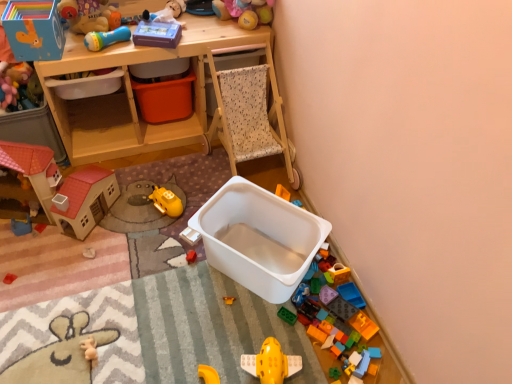
Question: Is blue plastic toy at left, which appears as the fifth toy when viewed from the top, aimed at soft plush toy at upper center, the fifth toy positioned from the right?

Choices:
 (A) no
 (B) yes

Answer: (A)

Question: Is blue plastic toy at left, arranged as the 6th toy when ordered from the bottom, at the right side of soft plush toy at upper center, which is the sixth toy from left to right?

Choices:
 (A) yes
 (B) no

Answer: (B)

Question: Are blue plastic toy at left, arranged as the 6th toy when ordered from the bottom, and soft plush toy at upper center, the fifth toy positioned from the right, far apart?

Choices:
 (A) yes
 (B) no

Answer: (A)

Question: Is blue plastic toy at left, which appears as the first toy when viewed from the left, directly adjacent to soft plush toy at upper center, which appears as the 1th toy when viewed from the top?

Choices:
 (A) no
 (B) yes

Answer: (A)

Question: From the image's perspective, is blue plastic toy at left, which appears as the first toy when viewed from the left, located beneath soft plush toy at upper center, which is the sixth toy from left to right?

Choices:
 (A) no
 (B) yes

Answer: (B)

Question: Considering their positions, is blue plastic toy at left, arranged as the 6th toy when ordered from the bottom, located in front of or behind translucent plastic blocks at lower right, which is the 5th toy from bottom to top?

Choices:
 (A) front
 (B) behind

Answer: (B)

Question: From the image's perspective, relative to translucent plastic blocks at lower right, which is the 5th toy from bottom to top, is blue plastic toy at left, which appears as the fifth toy when viewed from the top, above or below?

Choices:
 (A) below
 (B) above

Answer: (B)

Question: Is point (16, 228) closer or farther from the camera than point (339, 271)?

Choices:
 (A) closer
 (B) farther

Answer: (B)

Question: In terms of height, does blue plastic toy at left, arranged as the 10th toy when viewed from the right, look taller or shorter compared to translucent plastic blocks at lower right, which ranks as the third toy in right-to-left order?

Choices:
 (A) tall
 (B) short

Answer: (B)

Question: In terms of height, does rubber duck at lower left, the 9th toy in the top-to-bottom sequence, look taller or shorter compared to translucent plastic blocks at lower right, which ranks as the third toy in right-to-left order?

Choices:
 (A) tall
 (B) short

Answer: (B)

Question: In the image, is rubber duck at lower left, the sixth toy positioned from the right, on the left side or the right side of translucent plastic blocks at lower right, which is the 5th toy from bottom to top?

Choices:
 (A) right
 (B) left

Answer: (B)

Question: Relative to translucent plastic blocks at lower right, marked as the sixth toy in a top-to-bottom arrangement, is rubber duck at lower left, the 9th toy in the top-to-bottom sequence, in front or behind?

Choices:
 (A) behind
 (B) front

Answer: (B)

Question: From the image's perspective, is rubber duck at lower left, the 9th toy in the top-to-bottom sequence, positioned above or below translucent plastic blocks at lower right, which is the 5th toy from bottom to top?

Choices:
 (A) below
 (B) above

Answer: (A)

Question: From a real-world perspective, is yellow plastic airplane at center, the 1th toy ordered from the bottom, positioned above or below translucent plastic blocks at lower right, the third toy ordered from the bottom?

Choices:
 (A) above
 (B) below

Answer: (A)

Question: From the image's perspective, is yellow plastic airplane at center, the 1th toy ordered from the bottom, above or below translucent plastic blocks at lower right, acting as the tenth toy starting from the left?

Choices:
 (A) above
 (B) below

Answer: (B)